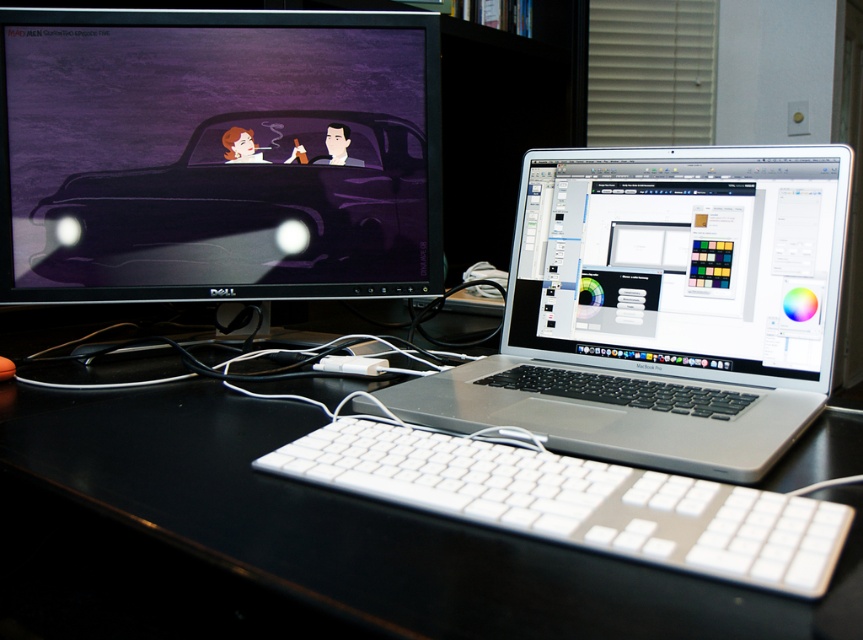
Question: Does silver metallic laptop at center appear on the right side of satin silver laptop at center?

Choices:
 (A) no
 (B) yes

Answer: (A)

Question: Considering the real-world distances, which object is closest to the satin silver laptop at center?

Choices:
 (A) matte black monitor at upper left
 (B) black glossy computer desk at center
 (C) white plastic keyboard at center
 (D) silver metallic laptop at center

Answer: (D)

Question: Is matte black monitor at upper left positioned in front of silver metallic laptop at center?

Choices:
 (A) yes
 (B) no

Answer: (B)

Question: Is silver metallic laptop at center in front of white plastic keyboard at center?

Choices:
 (A) no
 (B) yes

Answer: (A)

Question: Which object is farther from the camera taking this photo?

Choices:
 (A) silver metallic laptop at center
 (B) matte black monitor at upper left

Answer: (B)

Question: Which of these objects is positioned farthest from the matte black monitor at upper left?

Choices:
 (A) satin silver laptop at center
 (B) black glossy computer desk at center
 (C) silver metallic laptop at center

Answer: (C)